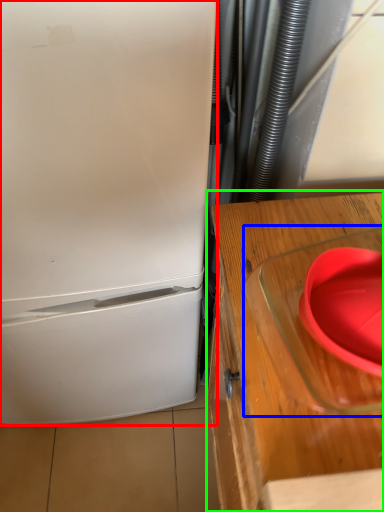
Question: Which object is the farthest from refrigerator (highlighted by a red box)? Choose among these: appliance (highlighted by a blue box) or table (highlighted by a green box).

Choices:
 (A) appliance
 (B) table

Answer: (A)